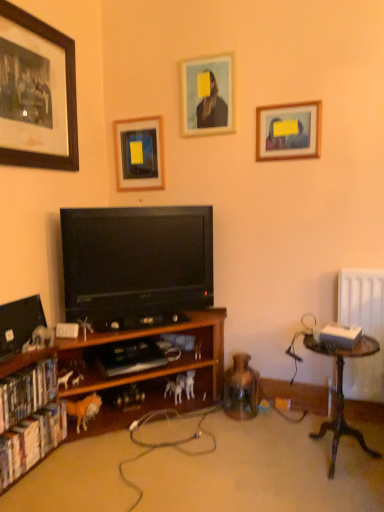
I want to click on vacant region under wooden table at right (from a real-world perspective), so click(x=335, y=460).